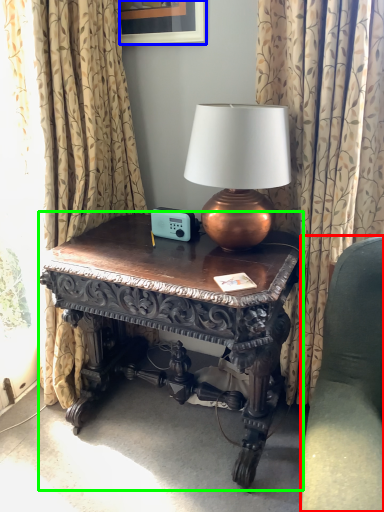
Question: Which object is the closest to the studio couch (highlighted by a red box)? Choose among these: picture frame (highlighted by a blue box) or table (highlighted by a green box).

Choices:
 (A) picture frame
 (B) table

Answer: (B)